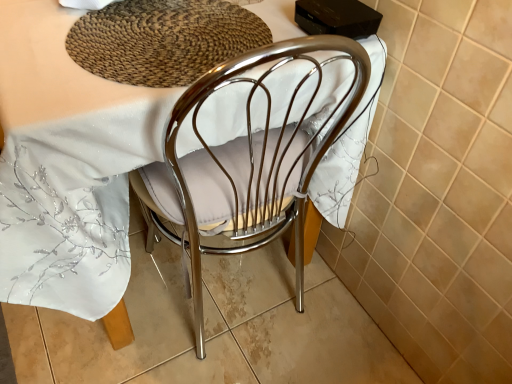
The image size is (512, 384). Describe the element at coordinates (258, 158) in the screenshot. I see `polished chrome chair at center` at that location.

In order to face polished chrome chair at center, should I rotate leftwards or rightwards?

Rotate your view left by about 12.379°.

Where is `polished chrome chair at center`? polished chrome chair at center is located at coordinates (258, 158).

Where is `woven brown mat at upper center`? woven brown mat at upper center is located at coordinates (163, 40).

What do you see at coordinates (163, 40) in the screenshot?
I see `woven brown mat at upper center` at bounding box center [163, 40].

Locate an element on the screen. polished chrome chair at center is located at coordinates (258, 158).

Between woven brown mat at upper center and polished chrome chair at center, which one appears on the left side from the viewer's perspective?

polished chrome chair at center is more to the left.

Is woven brown mat at upper center positioned behind polished chrome chair at center?

Yes.

Is point (113, 59) closer to viewer compared to point (293, 200)?

Yes, point (113, 59) is in front of point (293, 200).

From the picture: From the image's perspective, which is below, woven brown mat at upper center or polished chrome chair at center?

polished chrome chair at center, from the image's perspective.

From a real-world perspective, between woven brown mat at upper center and polished chrome chair at center, who is vertically lower?

polished chrome chair at center, from a real-world perspective.

Which object is thinner, woven brown mat at upper center or polished chrome chair at center?

With smaller width is woven brown mat at upper center.

Considering the relative sizes of woven brown mat at upper center and polished chrome chair at center in the image provided, is woven brown mat at upper center taller than polished chrome chair at center?

No.

Considering the relative sizes of woven brown mat at upper center and polished chrome chair at center in the image provided, is woven brown mat at upper center smaller than polished chrome chair at center?

Correct, woven brown mat at upper center occupies less space than polished chrome chair at center.

Would you say woven brown mat at upper center is inside or outside polished chrome chair at center?

woven brown mat at upper center is enclosed within polished chrome chair at center.

Are woven brown mat at upper center and polished chrome chair at center beside each other?

No, woven brown mat at upper center is not making contact with polished chrome chair at center.

In the scene shown: Is woven brown mat at upper center aimed at polished chrome chair at center?

Yes, woven brown mat at upper center is turned towards polished chrome chair at center.

How different are the orientations of woven brown mat at upper center and polished chrome chair at center in degrees?

They differ by 1.1 degrees in their facing directions.

In order to click on chair that appears on the left of woven brown mat at upper center in this screenshot , I will do `click(258, 158)`.

Consider the image. Is polished chrome chair at center at the left side of woven brown mat at upper center?

Yes, polished chrome chair at center is to the left of woven brown mat at upper center.

Considering the positions of objects polished chrome chair at center and woven brown mat at upper center in the image provided, who is in front, polished chrome chair at center or woven brown mat at upper center?

Positioned in front is polished chrome chair at center.

Considering the points (356, 87) and (113, 63), which point is in front, point (356, 87) or point (113, 63)?

The point (113, 63) is more forward.

From the image's perspective, is polished chrome chair at center beneath woven brown mat at upper center?

Indeed, from the image's perspective, polished chrome chair at center is shown beneath woven brown mat at upper center.

From a real-world perspective, which is physically above, polished chrome chair at center or woven brown mat at upper center?

From a 3D spatial view, woven brown mat at upper center is above.

Considering the sizes of polished chrome chair at center and woven brown mat at upper center in the image, is polished chrome chair at center wider or thinner than woven brown mat at upper center?

polished chrome chair at center is wider than woven brown mat at upper center.

Can you confirm if polished chrome chair at center is shorter than woven brown mat at upper center?

No, polished chrome chair at center is not shorter than woven brown mat at upper center.

Is polished chrome chair at center bigger or smaller than woven brown mat at upper center?

Clearly, polished chrome chair at center is larger in size than woven brown mat at upper center.

Does polished chrome chair at center contain woven brown mat at upper center?

Absolutely, woven brown mat at upper center is inside polished chrome chair at center.

Is polished chrome chair at center not close to woven brown mat at upper center?

Actually, polished chrome chair at center and woven brown mat at upper center are a little close together.

Is polished chrome chair at center turned away from woven brown mat at upper center?

polished chrome chair at center does not have its back to woven brown mat at upper center.

How much distance is there between polished chrome chair at center and woven brown mat at upper center?

polished chrome chair at center and woven brown mat at upper center are 8.15 inches apart.

Where is `chair located in front of the woven brown mat at upper center`? Image resolution: width=512 pixels, height=384 pixels. chair located in front of the woven brown mat at upper center is located at coordinates (258, 158).

Find the location of `mat above the polished chrome chair at center (from the image's perspective)`. mat above the polished chrome chair at center (from the image's perspective) is located at coordinates (163, 40).

I want to click on chair that appears below the woven brown mat at upper center (from a real-world perspective), so click(258, 158).